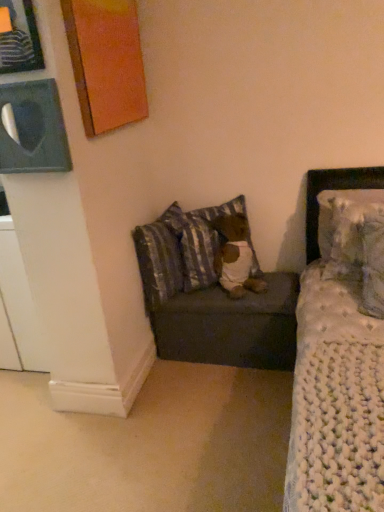
Question: Would you say striped fabric pillow at lower center, which ranks as the third pillow in right-to-left order, is inside or outside brown plush bear at center?

Choices:
 (A) outside
 (B) inside

Answer: (A)

Question: From a real-world perspective, relative to brown plush bear at center, is striped fabric pillow at lower center, the 2th pillow positioned from the left, vertically above or below?

Choices:
 (A) above
 (B) below

Answer: (A)

Question: Which object is positioned farthest from the brown plush bear at center?

Choices:
 (A) white fluffy pillow at upper right, which is the 1th pillow from right to left
 (B) orange painted wood picture frame at upper left, positioned as the second picture frame in back-to-front order
 (C) dark gray fabric ottoman at center
 (D) matte black picture frame at upper left, placed as the 3th picture frame when sorted from front to back
 (E) striped fabric pillow at lower left, which is counted as the first pillow, starting from the left

Answer: (D)

Question: Which is farther from the striped fabric pillow at lower left, which is counted as the first pillow, starting from the left?

Choices:
 (A) white knitted pillow at upper right, placed as the second pillow when sorted from right to left
 (B) dark gray fabric ottoman at center
 (C) matte black picture frame at upper left, which is the first picture frame from back to front
 (D) matte black picture frame at upper left, which is the 1th picture frame in front-to-back order
 (E) orange painted wood picture frame at upper left, positioned as the second picture frame in back-to-front order

Answer: (D)